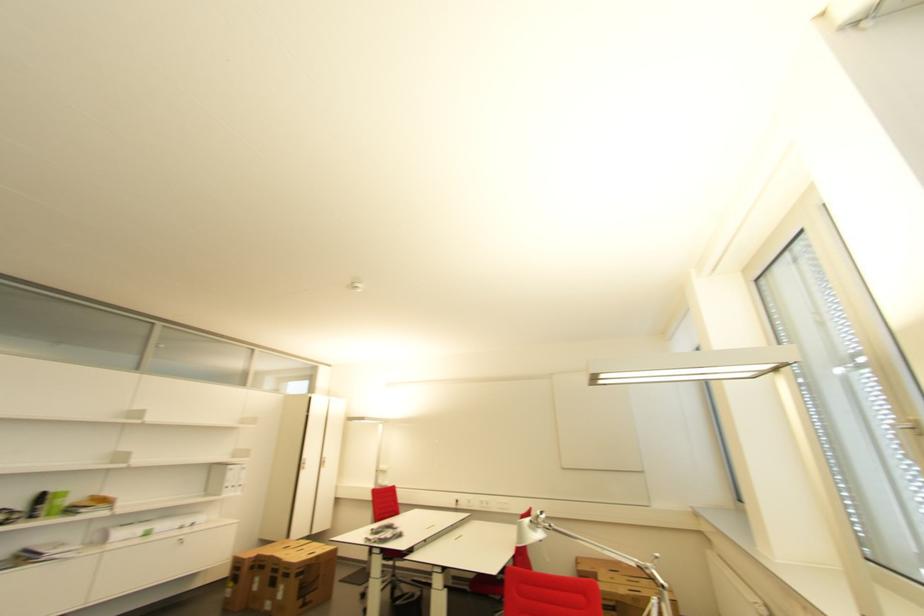
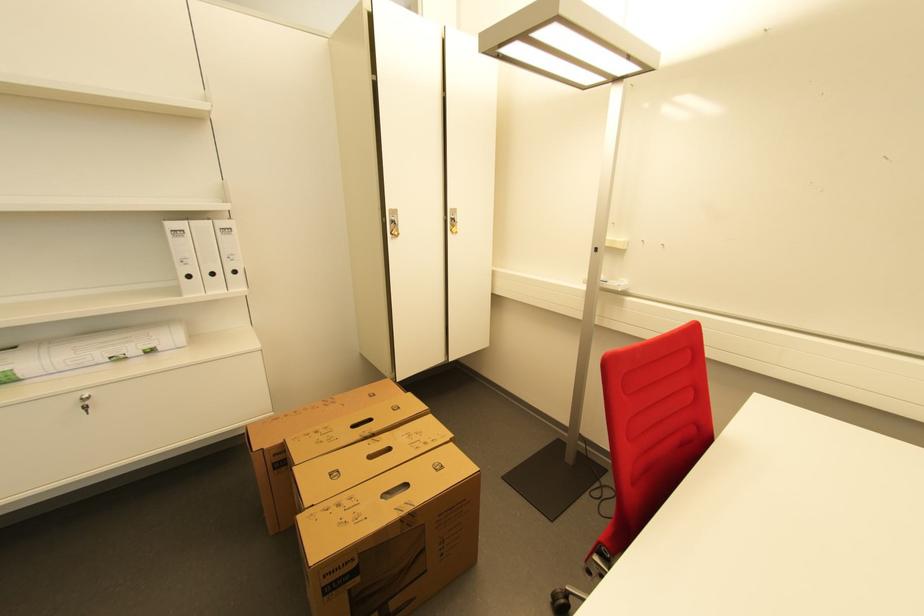
Find the pixel in the second image that matches (x=199, y=525) in the first image.

(155, 352)